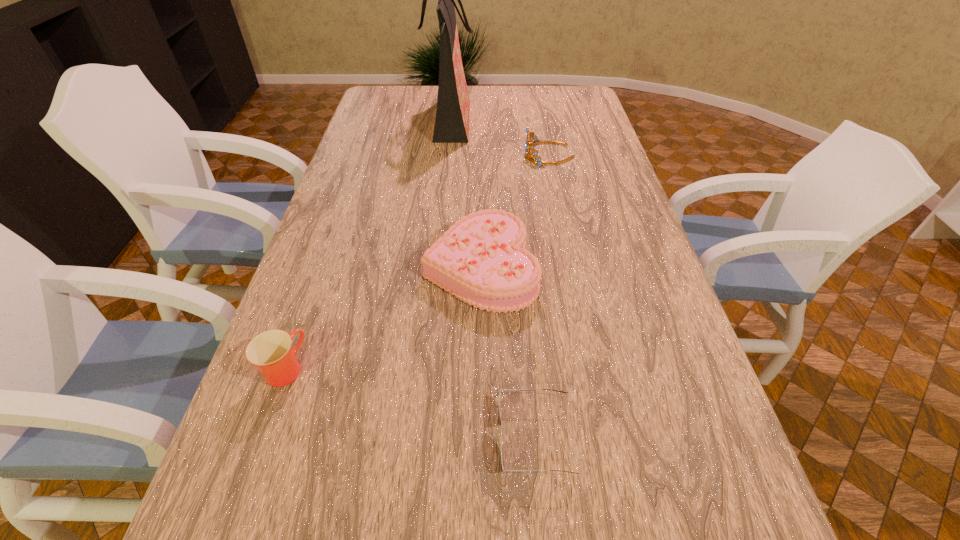
Point out which object is positioned as the second nearest to the tiara. Please provide its 2D coordinates. Your answer should be formatted as a tuple, i.e. [(x, y)], where the tuple contains the x and y coordinates of a point satisfying the conditions above.

[(482, 260)]